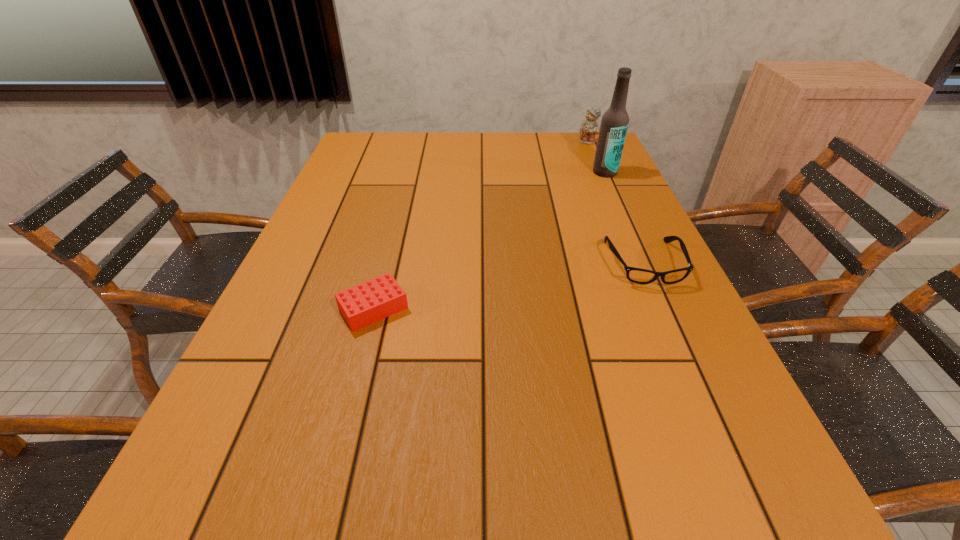
Locate an element on the screen. This screenshot has height=540, width=960. free spot on the desktop that is between the Lego and the spectacles and is positioned on the side of the beer bottle with the label is located at coordinates (550, 279).

This screenshot has width=960, height=540. I want to click on free space on the desktop that is between the Lego and the spectacles and is positioned on the front-facing side of the teddy bear, so click(x=500, y=287).